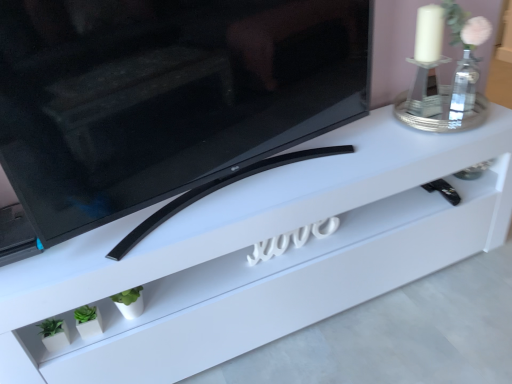
Where is `vacant space situated on the left part of white glass candle holder at upper right`? This screenshot has height=384, width=512. vacant space situated on the left part of white glass candle holder at upper right is located at coordinates (392, 132).